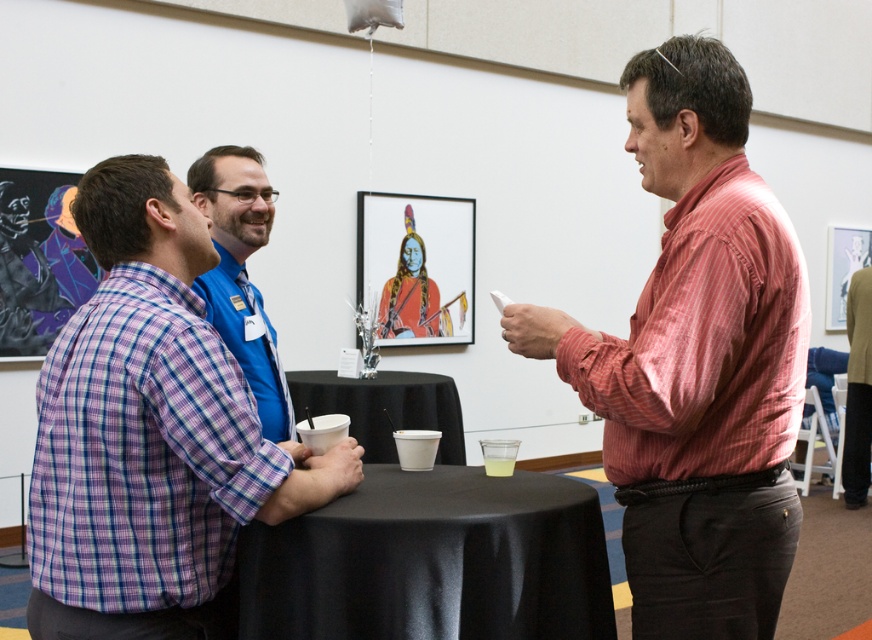
Can you confirm if red plaid shirt at right is thinner than dark brown leather jacket at lower right?

No.

Between point (732, 339) and point (870, 278), which one is positioned in front?

Point (732, 339)

Who is more distant from viewer, [720,483] or [857,417]?

The point [857,417] is more distant.

The height and width of the screenshot is (640, 872). Identify the location of red plaid shirt at right. click(x=696, y=362).

Which is above, purple checkered shirt at left or blue shirt at center?

blue shirt at center is higher up.

Who is positioned more to the left, purple checkered shirt at left or blue shirt at center?

blue shirt at center is more to the left.

Locate an element on the screen. purple checkered shirt at left is located at coordinates (151, 433).

In order to click on purple checkered shirt at left in this screenshot , I will do `click(151, 433)`.

Is purple checkered shirt at left positioned behind black satin table at center?

No, purple checkered shirt at left is closer to the viewer.

Can you confirm if purple checkered shirt at left is thinner than black satin table at center?

Indeed, purple checkered shirt at left has a lesser width compared to black satin table at center.

Is point (133, 538) closer to viewer compared to point (278, 528)?

Yes, point (133, 538) is closer to viewer.

Locate an element on the screen. The height and width of the screenshot is (640, 872). purple checkered shirt at left is located at coordinates (151, 433).